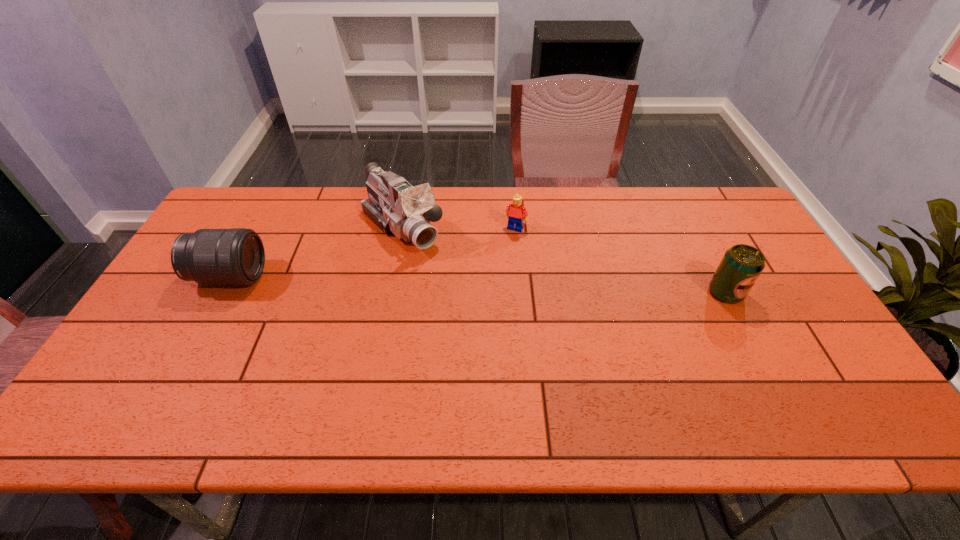
Find the location of a particular element. free region located on the front-facing side of the third object from right to left is located at coordinates (460, 287).

This screenshot has width=960, height=540. Find the location of `vacant space located 0.270m on the front-facing side of the third object from right to left`. vacant space located 0.270m on the front-facing side of the third object from right to left is located at coordinates (479, 306).

Find the location of a particular element. The height and width of the screenshot is (540, 960). free space located on the front-facing side of the third object from right to left is located at coordinates (462, 288).

At what (x,y) coordinates should I click in order to perform the action: click on Lego situated at the far edge. Please return your answer as a coordinate pair (x, y). Looking at the image, I should click on (515, 212).

Find the location of a particular element. The image size is (960, 540). camcorder positioned at the far edge is located at coordinates (395, 206).

The image size is (960, 540). What are the coordinates of `object that is at the left edge` in the screenshot? It's located at (236, 256).

Find the location of a particular element. object that is at the right edge is located at coordinates [741, 265].

I want to click on vacant space at the far edge of the desktop, so click(533, 204).

In the image, there is a desktop. In order to click on vacant space at the near edge in this screenshot , I will do `click(460, 388)`.

In the image, there is a desktop. Where is `vacant space at the left edge`? The width and height of the screenshot is (960, 540). vacant space at the left edge is located at coordinates (188, 316).